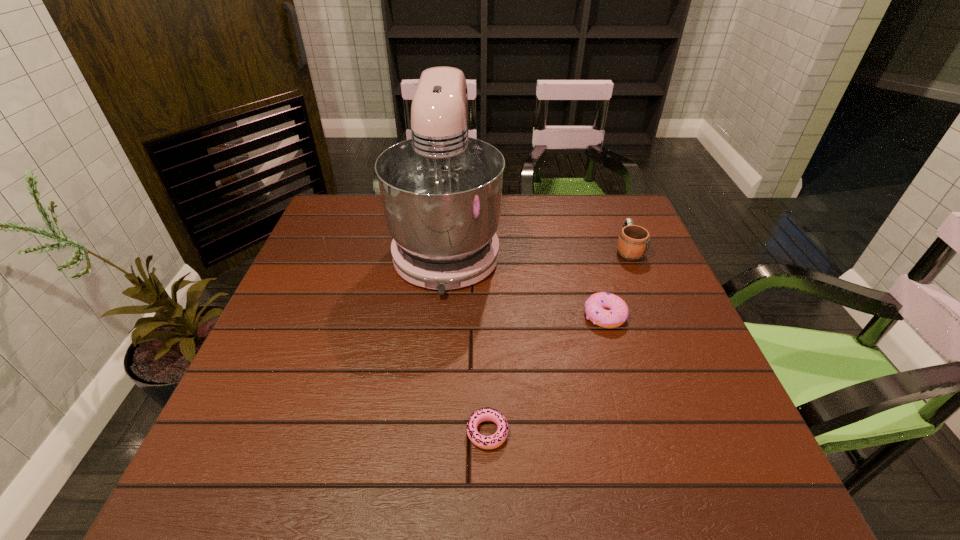
The height and width of the screenshot is (540, 960). What are the coordinates of `vacant space at the far left corner` in the screenshot? It's located at click(x=344, y=227).

Locate an element on the screen. This screenshot has width=960, height=540. vacant space at the far right corner of the desktop is located at coordinates (608, 213).

Where is `vacant space at the near right corner of the desktop`? This screenshot has height=540, width=960. vacant space at the near right corner of the desktop is located at coordinates click(734, 460).

The image size is (960, 540). Find the location of `vacant space in between the farther doughnut and the tallest object`. vacant space in between the farther doughnut and the tallest object is located at coordinates (526, 281).

This screenshot has width=960, height=540. I want to click on free area in between the shorter doughnut and the right doughnut, so click(546, 374).

I want to click on vacant space that's between the right doughnut and the tallest object, so [x=526, y=281].

Identify the location of free spot between the third shortest object and the tallest object. The width and height of the screenshot is (960, 540). (538, 248).

Image resolution: width=960 pixels, height=540 pixels. I want to click on blank region between the tallest object and the shortest object, so click(x=468, y=339).

The width and height of the screenshot is (960, 540). I want to click on unoccupied area between the rightmost object and the shorter doughnut, so click(558, 341).

Find the location of a particular element. This screenshot has height=540, width=960. vacant area that lies between the mug and the left doughnut is located at coordinates (558, 341).